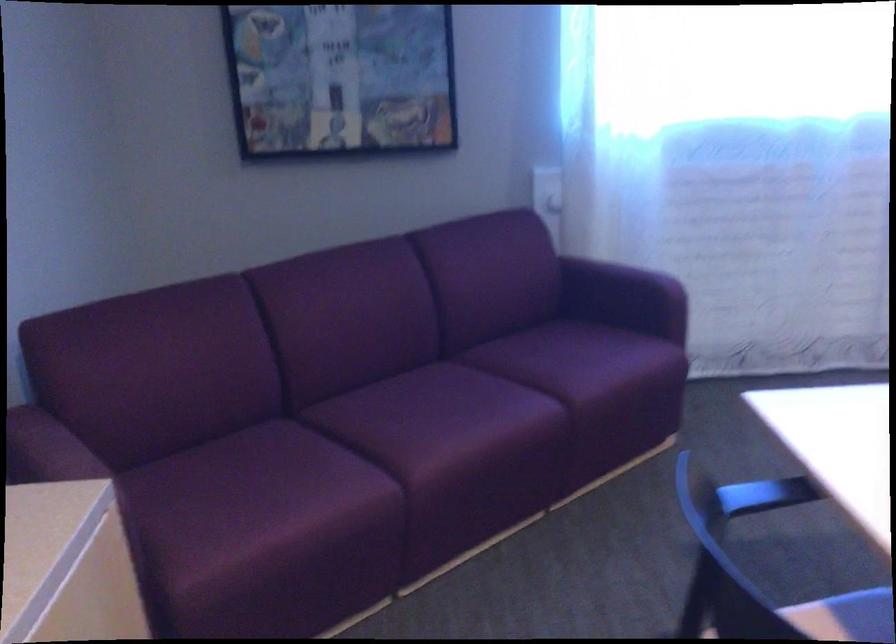
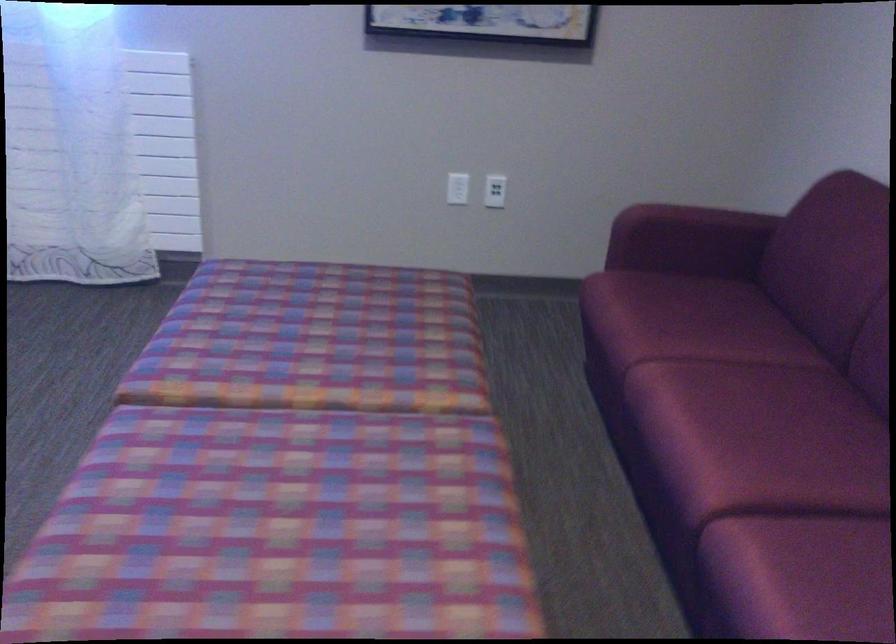
Question: In a continuous first-person perspective shot, in which direction is the camera moving?

Choices:
 (A) Left
 (B) Right
 (C) Forward
 (D) Backward

Answer: (B)